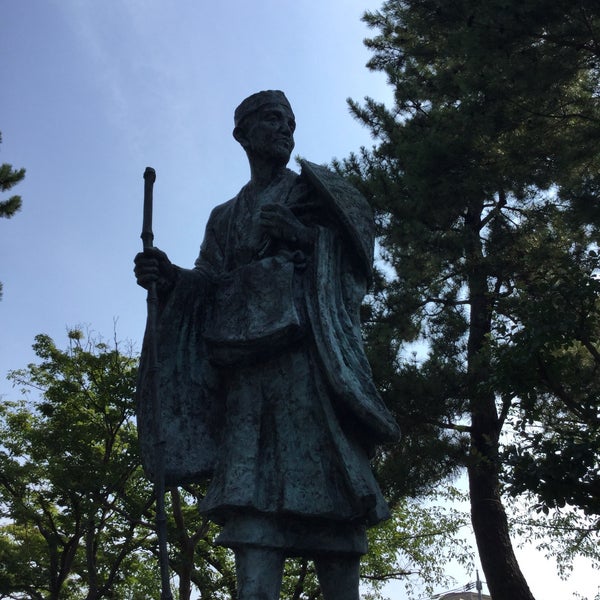
Where is `rod`? The image size is (600, 600). rod is located at coordinates 161,526, 146,211.